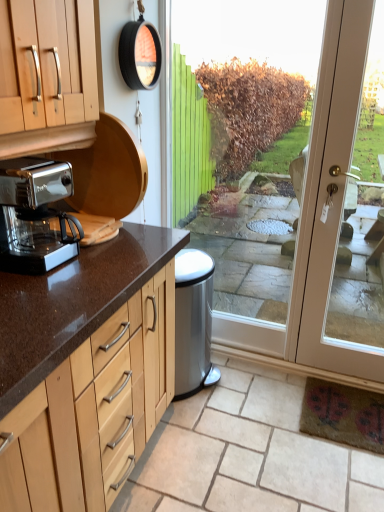
Locate an element on the screen. Image resolution: width=384 pixels, height=512 pixels. empty space that is ontop of light brown wood at lower left (from a real-world perspective) is located at coordinates (256, 441).